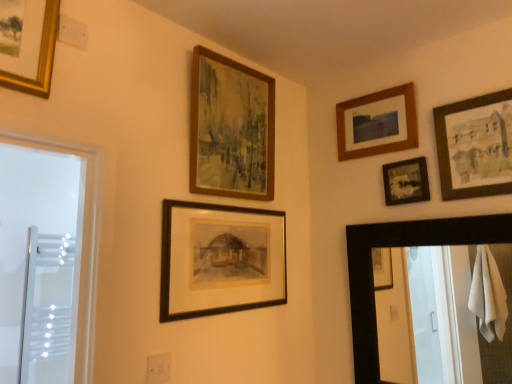
Question: From the image's perspective, is wooden frame at upper right, marked as the 3th picture frame in a left-to-right arrangement, on black wooden mirror at right?

Choices:
 (A) yes
 (B) no

Answer: (A)

Question: From a real-world perspective, is wooden frame at upper right, marked as the 3th picture frame in a left-to-right arrangement, physically above black wooden mirror at right?

Choices:
 (A) no
 (B) yes

Answer: (B)

Question: Is black wooden mirror at right completely or partially inside wooden frame at upper right, arranged as the 3th picture frame when viewed from the right?

Choices:
 (A) yes
 (B) no

Answer: (B)

Question: Is wooden frame at upper right, arranged as the 3th picture frame when viewed from the right, shorter than black wooden mirror at right?

Choices:
 (A) no
 (B) yes

Answer: (B)

Question: Does wooden frame at upper right, arranged as the 3th picture frame when viewed from the right, appear on the right side of black wooden mirror at right?

Choices:
 (A) yes
 (B) no

Answer: (B)

Question: From a real-world perspective, is wooden frame at upper right, arranged as the 3th picture frame when viewed from the right, under black wooden mirror at right?

Choices:
 (A) yes
 (B) no

Answer: (B)

Question: Is transparent glass screen door at left not inside black wooden mirror at right?

Choices:
 (A) no
 (B) yes

Answer: (B)

Question: Considering the relative sizes of transparent glass screen door at left and black wooden mirror at right in the image provided, is transparent glass screen door at left smaller than black wooden mirror at right?

Choices:
 (A) yes
 (B) no

Answer: (A)

Question: Considering the relative sizes of transparent glass screen door at left and black wooden mirror at right in the image provided, is transparent glass screen door at left shorter than black wooden mirror at right?

Choices:
 (A) no
 (B) yes

Answer: (A)

Question: Is transparent glass screen door at left thinner than black wooden mirror at right?

Choices:
 (A) yes
 (B) no

Answer: (B)

Question: Considering the relative sizes of transparent glass screen door at left and black wooden mirror at right in the image provided, is transparent glass screen door at left bigger than black wooden mirror at right?

Choices:
 (A) yes
 (B) no

Answer: (B)

Question: Is transparent glass screen door at left to the left of black wooden mirror at right from the viewer's perspective?

Choices:
 (A) no
 (B) yes

Answer: (B)

Question: Is wooden-framed painting at upper center, which appears as the 2th picture frame when viewed from the left, smaller than transparent glass screen door at left?

Choices:
 (A) yes
 (B) no

Answer: (B)